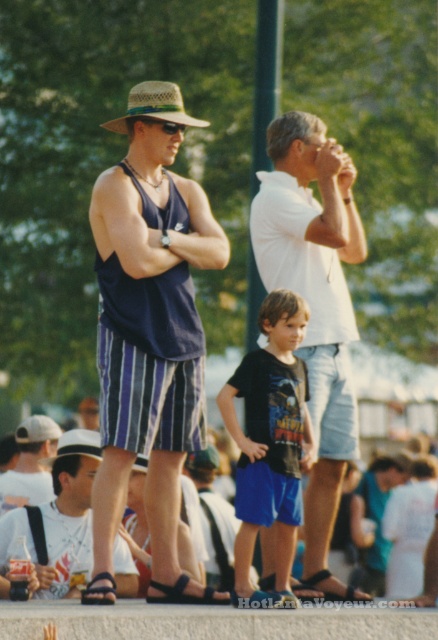
You are a photographer trying to capture a shot of the black cotton shirt at center. Based on its position coordinates, where should you aim your camera?

The black cotton shirt at center is located at coordinates point (269,440), so you should aim your camera at that specific point to capture it.

You are a photographer trying to capture a clear photo of the white cotton shirt at center and the straw hat at center. Which object should you focus on first if you want to ensure both are in focus without moving the camera?

The white cotton shirt at center should be focused on first because the straw hat at center is behind it, so adjusting focus starting from the closer object will help ensure both are in focus.